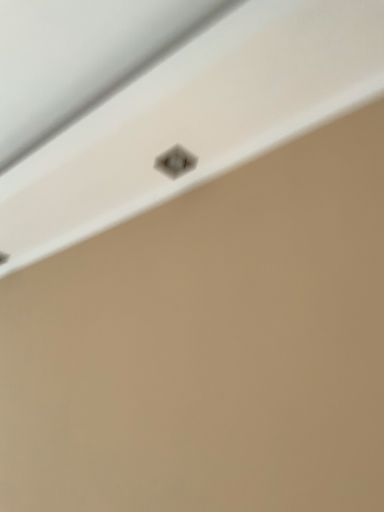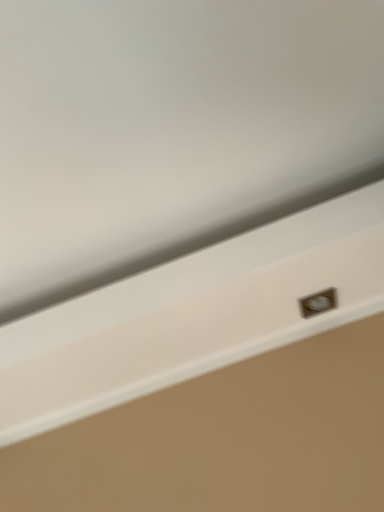
Question: Which way did the camera rotate in the video?

Choices:
 (A) rotated upward
 (B) rotated downward

Answer: (A)